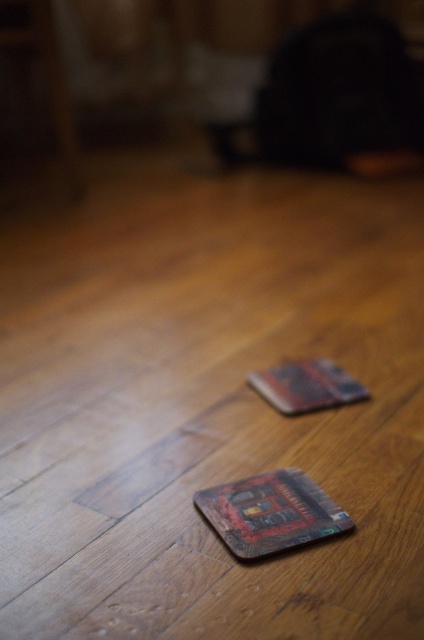
Who is lower down, wooden coaster at center or wooden textured card at center?

wooden coaster at center

Does wooden coaster at center have a greater height compared to wooden textured card at center?

No.

Does point (290, 508) come in front of point (267, 378)?

Yes.

Locate an element on the screen. The width and height of the screenshot is (424, 640). wooden coaster at center is located at coordinates (270, 513).